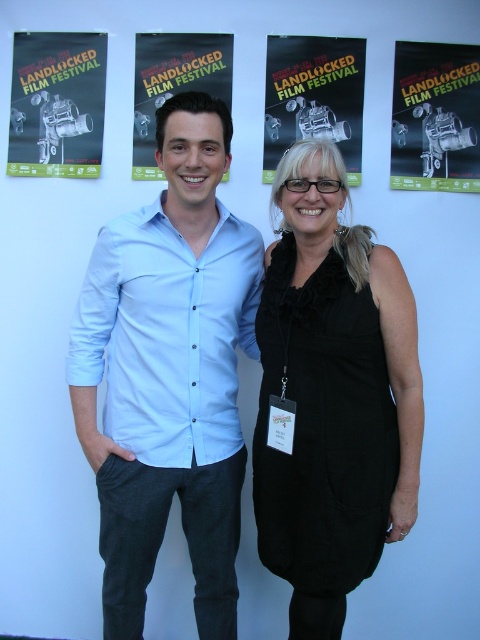
Can you confirm if matte paper camera at upper left is positioned to the left of matte black film festival poster at center?

Correct, you'll find matte paper camera at upper left to the left of matte black film festival poster at center.

Who is more forward, (49,170) or (363,68)?

Point (363,68) is in front.

Describe the element at coordinates (57, 104) in the screenshot. This screenshot has height=640, width=480. I see `matte paper camera at upper left` at that location.

This screenshot has width=480, height=640. Identify the location of matte paper camera at upper left. (57, 104).

Between point (204, 109) and point (444, 81), which one is positioned behind?

The point (444, 81) is behind.

Identify the location of light blue button-up shirt at center. (168, 372).

Does matte paper camera at upper left have a greater height compared to matte black film camera at upper right?

In fact, matte paper camera at upper left may be shorter than matte black film camera at upper right.

Which is behind, point (20, 141) or point (467, 54)?

Positioned behind is point (20, 141).

Between point (61, 52) and point (432, 148), which one is positioned in front?

Point (432, 148) is more forward.

Identify the location of matte paper camera at upper left. (57, 104).